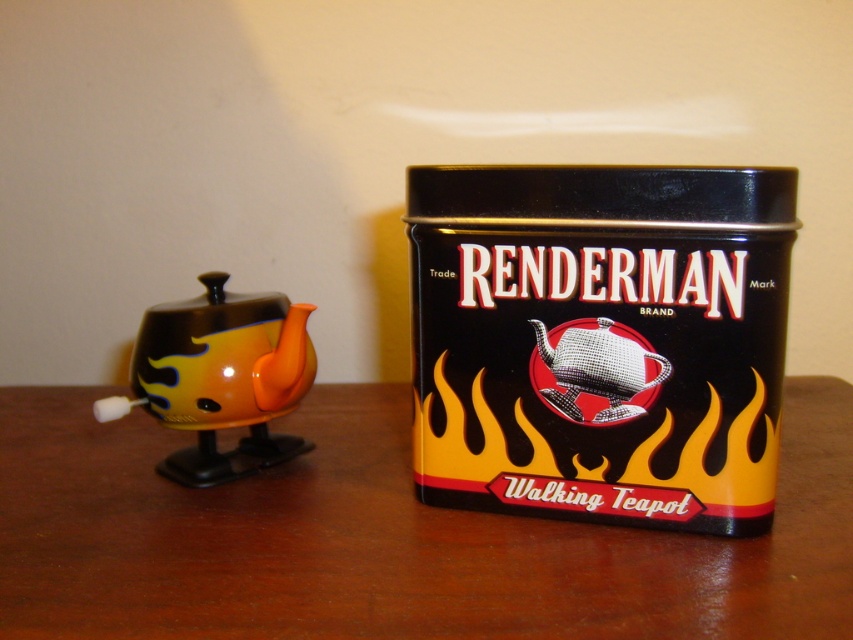
You are setting up a display on the wooden table at center. You want to place a new decorative item on top of the shiny metallic teapot at center. Is there enough space for the item to be placed on top of the teapot?

The wooden table at center is positioned under the shiny metallic teapot at center, meaning the teapot is elevated above the table. Therefore, there should be sufficient space to place the new decorative item on top of the shiny metallic teapot at center.